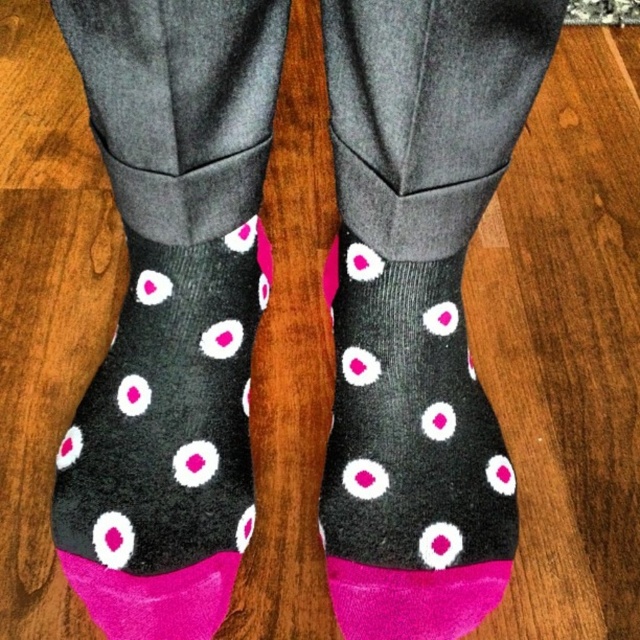
You are trying to decide which pair of socks to wear today. You have the black fuzzy socks at center and the pink dotted socks at center. Which pair is shorter?

The black fuzzy socks at center are shorter than the pink dotted socks at center.

You are a photographer trying to capture both the pink dotted socks at center and the matte black socks with pink dots at center in a single frame. Given that your camera has a minimum focus distance of 10 inches, will you be able to capture both socks clearly without moving the camera?

The pink dotted socks at center and the matte black socks with pink dots at center are 9.37 inches apart from each other, which is less than the camera minimum focus distance of 10 inches. Therefore, the camera cannot capture both socks clearly in a single frame without moving closer or adjusting the focus.